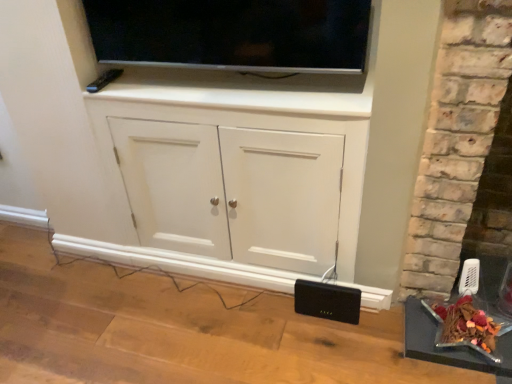
Question: Would you say metallic silver tray at lower right is to the left or to the right of black plastic speaker at lower right in the picture?

Choices:
 (A) left
 (B) right

Answer: (B)

Question: Is point (414, 326) positioned closer to the camera than point (348, 288)?

Choices:
 (A) farther
 (B) closer

Answer: (B)

Question: Based on their relative distances, which object is farther from the white matte cabinet at center?

Choices:
 (A) metallic silver tray at lower right
 (B) black plastic speaker at lower right
 (C) matte black tv at upper center

Answer: (A)

Question: Estimate the real-world distances between objects in this image. Which object is farther from the black plastic speaker at lower right?

Choices:
 (A) matte black tv at upper center
 (B) white matte cabinet at center
 (C) metallic silver tray at lower right

Answer: (A)